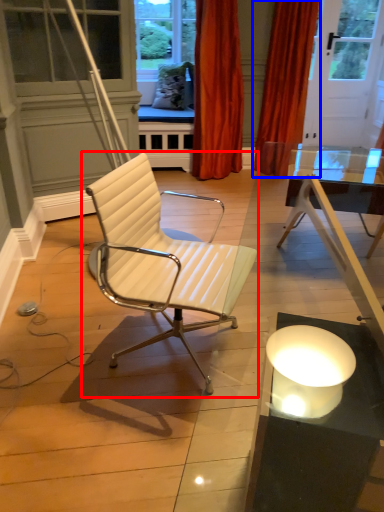
Question: Which of the following is the closest to the observer, chair (highlighted by a red box) or curtain (highlighted by a blue box)?

Choices:
 (A) chair
 (B) curtain

Answer: (A)